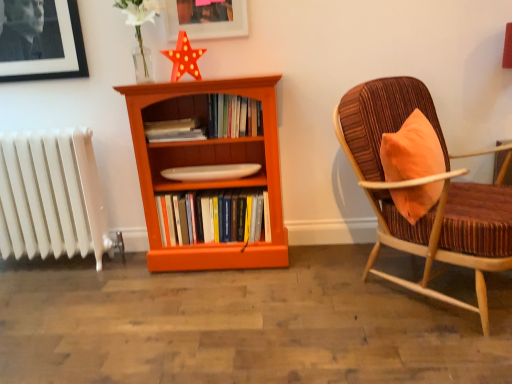
Question: From the image's perspective, is orange wood bookcase at center located above matte orange book at center, which is the 2th book from top to bottom?

Choices:
 (A) no
 (B) yes

Answer: (A)

Question: Is orange wood bookcase at center smaller than matte orange book at center, which is the 2th book from top to bottom?

Choices:
 (A) yes
 (B) no

Answer: (B)

Question: Is orange wood bookcase at center at the right side of matte orange book at center, which ranks as the second book in bottom-to-top order?

Choices:
 (A) yes
 (B) no

Answer: (A)

Question: From a real-world perspective, is orange wood bookcase at center located beneath matte orange book at center, which ranks as the second book in bottom-to-top order?

Choices:
 (A) yes
 (B) no

Answer: (A)

Question: Is orange wood bookcase at center wider than matte orange book at center, which is the 2th book from top to bottom?

Choices:
 (A) no
 (B) yes

Answer: (B)

Question: Does point (243, 264) appear closer or farther from the camera than point (421, 240)?

Choices:
 (A) farther
 (B) closer

Answer: (A)

Question: From a real-world perspective, is orange wood bookcase at center physically located above or below velvet brown chair with wooden frame at right?

Choices:
 (A) above
 (B) below

Answer: (A)

Question: Is orange wood bookcase at center bigger or smaller than velvet brown chair with wooden frame at right?

Choices:
 (A) small
 (B) big

Answer: (A)

Question: From the image's perspective, is orange wood bookcase at center above or below velvet brown chair with wooden frame at right?

Choices:
 (A) above
 (B) below

Answer: (A)

Question: From a real-world perspective, is hardcover books at center, marked as the 3th book in a top-to-bottom arrangement, above or below orange wood bookcase at center?

Choices:
 (A) below
 (B) above

Answer: (A)

Question: Is hardcover books at center, which is counted as the 1th book, starting from the bottom, wider or thinner than orange wood bookcase at center?

Choices:
 (A) wide
 (B) thin

Answer: (B)

Question: In terms of size, does hardcover books at center, marked as the 3th book in a top-to-bottom arrangement, appear bigger or smaller than orange wood bookcase at center?

Choices:
 (A) big
 (B) small

Answer: (B)

Question: From the image's perspective, is hardcover books at center, marked as the 3th book in a top-to-bottom arrangement, positioned above or below orange wood bookcase at center?

Choices:
 (A) above
 (B) below

Answer: (B)

Question: From the image's perspective, is velvet brown chair with wooden frame at right positioned above or below white matte flower at upper center?

Choices:
 (A) above
 (B) below

Answer: (B)

Question: Relative to white matte flower at upper center, is velvet brown chair with wooden frame at right in front or behind?

Choices:
 (A) behind
 (B) front

Answer: (B)